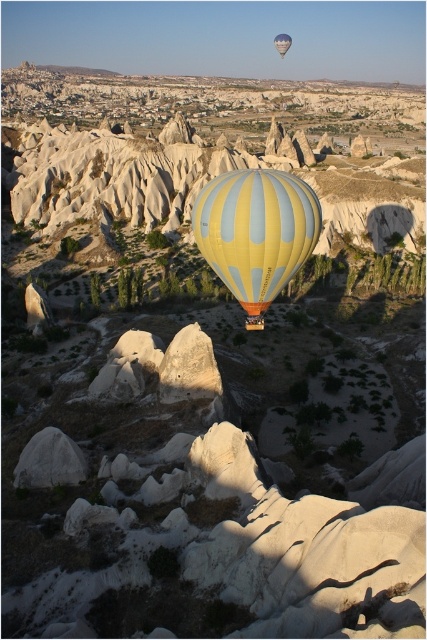
Is yellow striped balloon at center to the left of yellow striped fabric hot air balloon at center from the viewer's perspective?

Correct, you'll find yellow striped balloon at center to the left of yellow striped fabric hot air balloon at center.

Which of these two, yellow striped balloon at center or yellow striped fabric hot air balloon at center, stands taller?

With more height is yellow striped balloon at center.

Is point (295, 272) positioned before point (287, 44)?

Yes, it is.

Identify the location of yellow striped balloon at center. (256, 234).